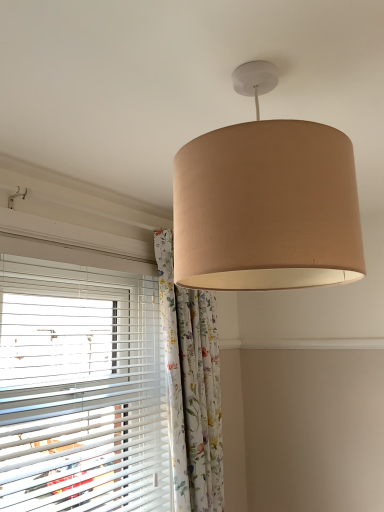
Question: Is beige fabric lampshade at upper center shorter than floral fabric curtain at center?

Choices:
 (A) no
 (B) yes

Answer: (B)

Question: Are beige fabric lampshade at upper center and floral fabric curtain at center making contact?

Choices:
 (A) yes
 (B) no

Answer: (B)

Question: Considering the relative positions of beige fabric lampshade at upper center and floral fabric curtain at center in the image provided, is beige fabric lampshade at upper center to the left of floral fabric curtain at center from the viewer's perspective?

Choices:
 (A) yes
 (B) no

Answer: (B)

Question: From a real-world perspective, is beige fabric lampshade at upper center positioned over floral fabric curtain at center based on gravity?

Choices:
 (A) yes
 (B) no

Answer: (A)

Question: Is beige fabric lampshade at upper center at the right side of floral fabric curtain at center?

Choices:
 (A) yes
 (B) no

Answer: (A)

Question: Relative to floral fabric curtain at center, is beige fabric lampshade at upper center in front or behind?

Choices:
 (A) front
 (B) behind

Answer: (A)

Question: From the image's perspective, relative to floral fabric curtain at center, is beige fabric lampshade at upper center above or below?

Choices:
 (A) above
 (B) below

Answer: (A)

Question: In terms of height, does beige fabric lampshade at upper center look taller or shorter compared to floral fabric curtain at center?

Choices:
 (A) short
 (B) tall

Answer: (A)

Question: Considering the positions of beige fabric lampshade at upper center and floral fabric curtain at center in the image, is beige fabric lampshade at upper center wider or thinner than floral fabric curtain at center?

Choices:
 (A) thin
 (B) wide

Answer: (B)

Question: From the image's perspective, relative to floral fabric curtain at center, is white plastic blinds at left above or below?

Choices:
 (A) above
 (B) below

Answer: (A)

Question: Is point (62, 326) positioned closer to the camera than point (213, 443)?

Choices:
 (A) closer
 (B) farther

Answer: (A)

Question: From a real-world perspective, relative to floral fabric curtain at center, is white plastic blinds at left vertically above or below?

Choices:
 (A) below
 (B) above

Answer: (B)

Question: Is white plastic blinds at left taller or shorter than floral fabric curtain at center?

Choices:
 (A) tall
 (B) short

Answer: (B)

Question: Based on their positions, is floral fabric curtain at center located to the left or right of white plastic blinds at left?

Choices:
 (A) left
 (B) right

Answer: (B)

Question: Which is correct: floral fabric curtain at center is inside white plastic blinds at left, or outside of it?

Choices:
 (A) inside
 (B) outside

Answer: (B)